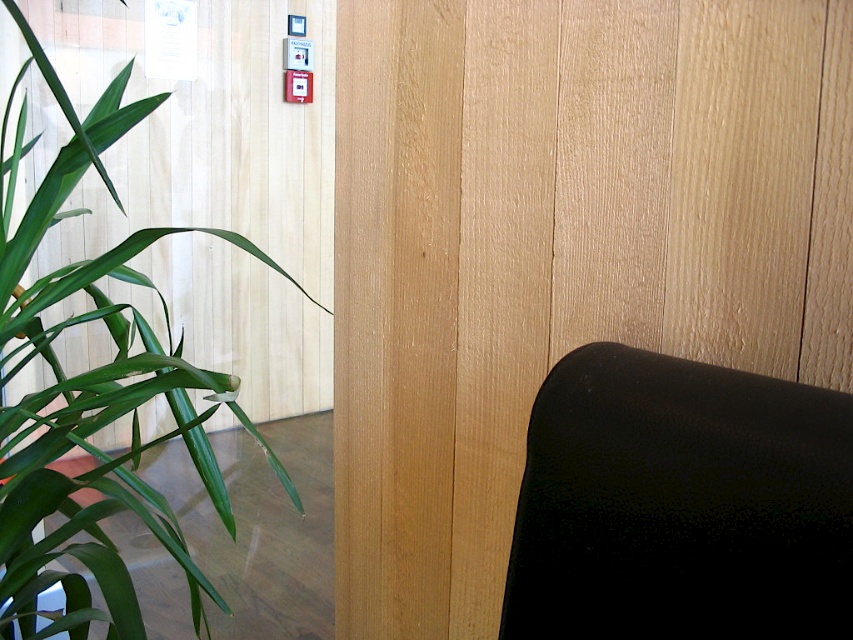
You are a maintenance worker needing to reach the red emergency button mounted on the wall. You see the black matte chair at right and the green leafy plant at left. Which object is closer to the red emergency button?

The green leafy plant at left is closer to the red emergency button because it is positioned to the left side of the image, whereas the black matte chair at right is on the opposite side.

Consider the image. You are standing in the office scene described. You need to sit down on the black matte chair at right. Based on your current position, in which general direction should you move to reach it?

You should move to your right since the black matte chair at right is located at point (680,504), which is to the right side of the scene.

You are an office worker who just entered the room and wants to sit down. You see the black matte chair at right and the green leafy plant at left. Which object is closer to you?

The green leafy plant at left is closer to you because it is partially out of frame, indicating proximity, while the black matte chair at right is further back near the wall.